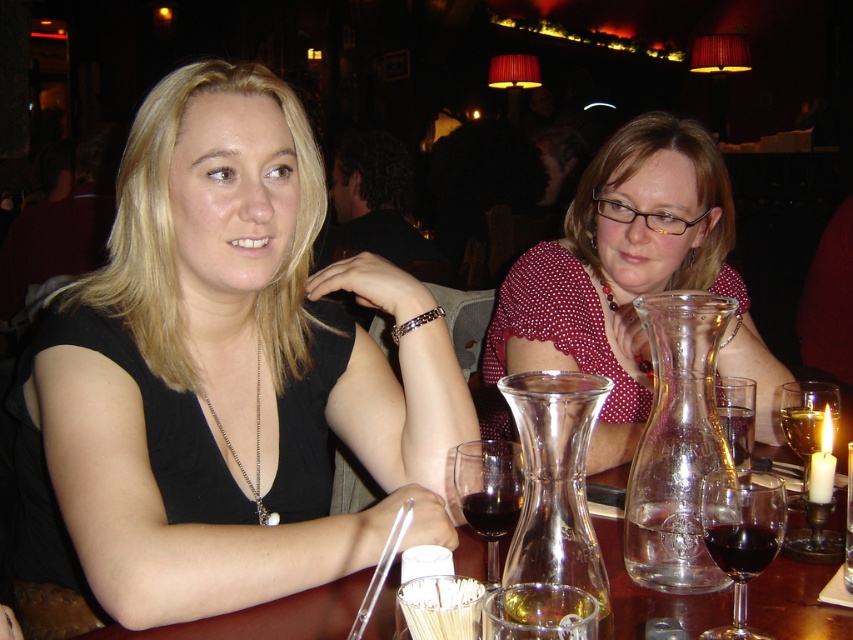
Which is in front, point (491, 346) or point (498, 512)?

Positioned in front is point (498, 512).

Who is positioned more to the right, polka dot blouse at center or dark glass wine at center?

polka dot blouse at center is more to the right.

What do you see at coordinates (630, 276) in the screenshot? The height and width of the screenshot is (640, 853). I see `polka dot blouse at center` at bounding box center [630, 276].

This screenshot has width=853, height=640. I want to click on polka dot blouse at center, so click(630, 276).

Is point (357, 592) closer to viewer compared to point (511, 506)?

No.

Does transparent glass carafe at center have a greater width compared to dark glass wine at center?

Yes, transparent glass carafe at center is wider than dark glass wine at center.

Between point (148, 634) and point (482, 524), which one is positioned in front?

Point (148, 634) is in front.

This screenshot has width=853, height=640. I want to click on transparent glass carafe at center, so click(267, 618).

Can you confirm if polka dot blouse at center is bigger than translucent glass wine at table center?

Yes.

Which is more to the right, polka dot blouse at center or translucent glass wine at table center?

translucent glass wine at table center

Is point (669, 236) positioned before point (822, 410)?

That is False.

Where is `polka dot blouse at center`? The width and height of the screenshot is (853, 640). polka dot blouse at center is located at coordinates (630, 276).